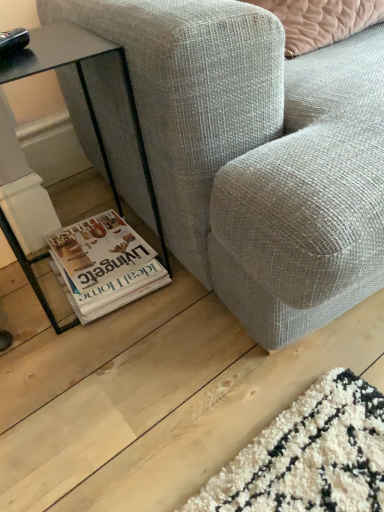
Question: From a real-world perspective, is textured gray fabric couch at lower center on top of black glass table at lower left?

Choices:
 (A) yes
 (B) no

Answer: (A)

Question: From the image's perspective, is textured gray fabric couch at lower center below black glass table at lower left?

Choices:
 (A) yes
 (B) no

Answer: (B)

Question: Does textured gray fabric couch at lower center have a lesser width compared to black glass table at lower left?

Choices:
 (A) yes
 (B) no

Answer: (B)

Question: Is textured gray fabric couch at lower center bigger than black glass table at lower left?

Choices:
 (A) no
 (B) yes

Answer: (B)

Question: Is black glass table at lower left inside textured gray fabric couch at lower center?

Choices:
 (A) no
 (B) yes

Answer: (A)

Question: From a real-world perspective, relative to white glossy magazine at lower left, is black glass table at lower left vertically above or below?

Choices:
 (A) above
 (B) below

Answer: (A)

Question: Which is correct: black glass table at lower left is inside white glossy magazine at lower left, or outside of it?

Choices:
 (A) outside
 (B) inside

Answer: (A)

Question: Is black glass table at lower left bigger or smaller than white glossy magazine at lower left?

Choices:
 (A) small
 (B) big

Answer: (B)

Question: Is black glass table at lower left in front of or behind white glossy magazine at lower left in the image?

Choices:
 (A) front
 (B) behind

Answer: (A)

Question: In terms of width, does textured gray fabric couch at lower center look wider or thinner when compared to white glossy magazine at lower left?

Choices:
 (A) wide
 (B) thin

Answer: (A)

Question: Relative to white glossy magazine at lower left, is textured gray fabric couch at lower center in front or behind?

Choices:
 (A) front
 (B) behind

Answer: (A)

Question: Considering the positions of textured gray fabric couch at lower center and white glossy magazine at lower left in the image, is textured gray fabric couch at lower center bigger or smaller than white glossy magazine at lower left?

Choices:
 (A) big
 (B) small

Answer: (A)

Question: Is textured gray fabric couch at lower center situated inside white glossy magazine at lower left or outside?

Choices:
 (A) outside
 (B) inside

Answer: (A)

Question: Based on their sizes in the image, would you say black glass table at lower left is bigger or smaller than textured gray fabric couch at lower center?

Choices:
 (A) small
 (B) big

Answer: (A)

Question: From a real-world perspective, relative to textured gray fabric couch at lower center, is black glass table at lower left vertically above or below?

Choices:
 (A) below
 (B) above

Answer: (A)